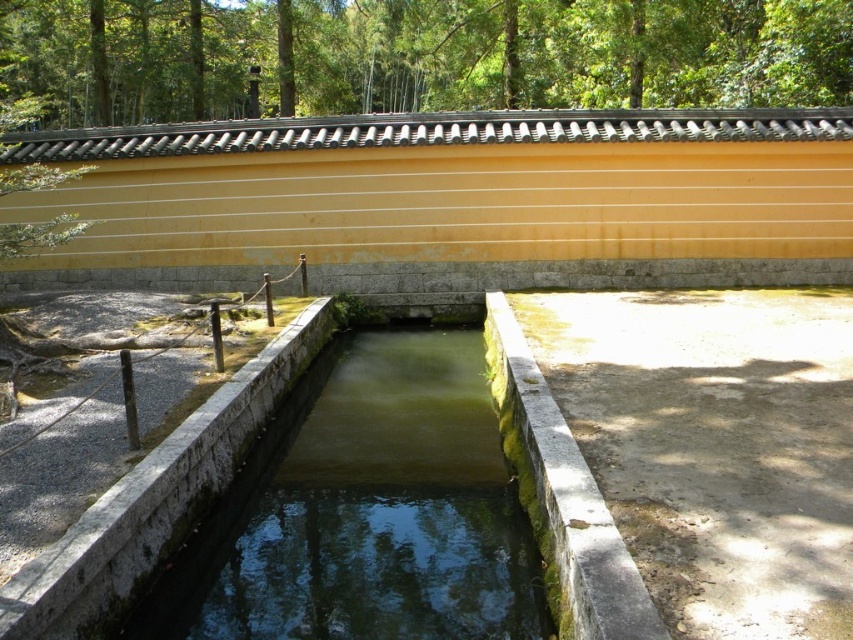
Is green leafy tree at upper center taller than green mossy stone water at center?

Yes.

Which is in front, point (643, 33) or point (231, 524)?

Positioned in front is point (231, 524).

At what (x,y) coordinates should I click in order to perform the action: click on green leafy tree at upper center. Please return your answer as a coordinate pair (x, y). The width and height of the screenshot is (853, 640). Looking at the image, I should click on (410, 56).